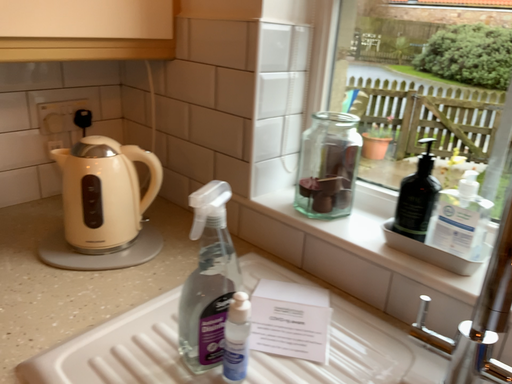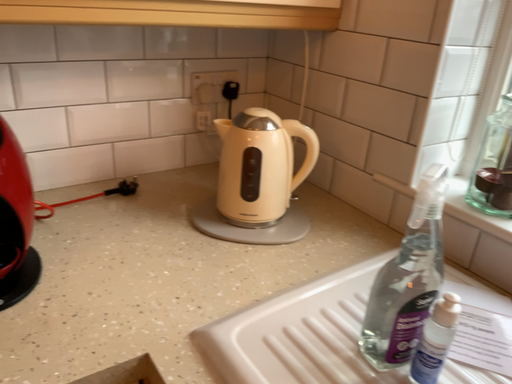
Question: How did the camera likely rotate when shooting the video?

Choices:
 (A) rotated left
 (B) rotated right

Answer: (A)